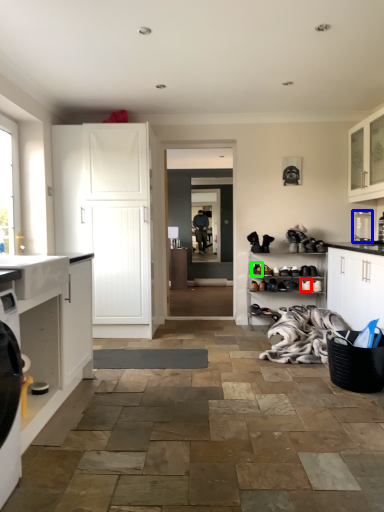
Question: Which is nearer to the shoe (highlighted by a red box)? appliance (highlighted by a blue box) or shoe (highlighted by a green box).

Choices:
 (A) appliance
 (B) shoe

Answer: (B)